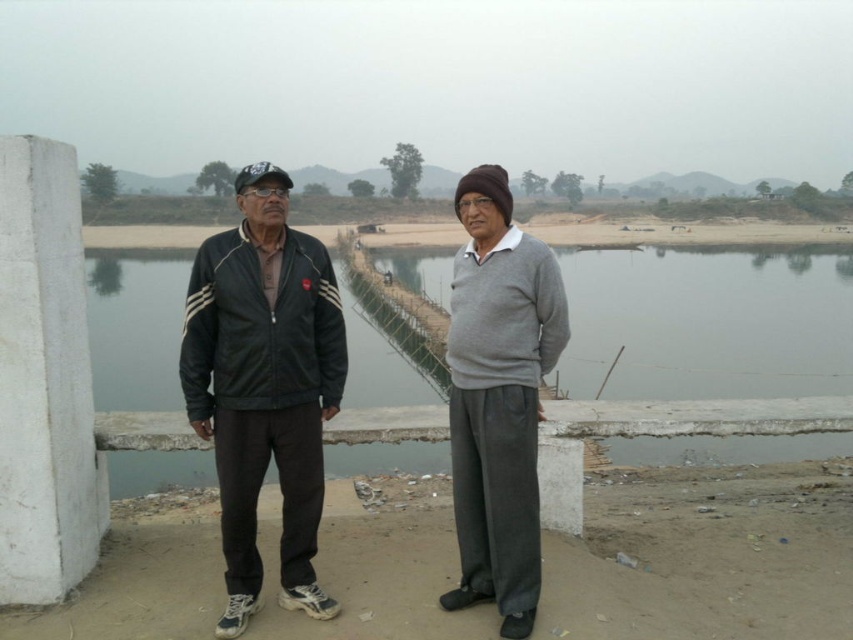
Is black leather jacket at center smaller than gray wool sweater at center?

Correct, black leather jacket at center occupies less space than gray wool sweater at center.

Which of these two, black leather jacket at center or gray wool sweater at center, stands shorter?

With less height is black leather jacket at center.

Between point (201, 403) and point (512, 445), which one is positioned behind?

The point (201, 403) is behind.

I want to click on black leather jacket at center, so click(x=263, y=385).

Which is below, black leather jacket at center or gray concrete river at center?

black leather jacket at center is below.

From the picture: Does black leather jacket at center have a greater height compared to gray concrete river at center?

Incorrect, black leather jacket at center's height is not larger of gray concrete river at center's.

Locate an element on the screen. This screenshot has width=853, height=640. black leather jacket at center is located at coordinates (263, 385).

This screenshot has height=640, width=853. I want to click on black leather jacket at center, so click(x=263, y=385).

Can you confirm if black leather jacket at left is smaller than gray wool sweater at center?

Actually, black leather jacket at left might be larger than gray wool sweater at center.

This screenshot has height=640, width=853. Describe the element at coordinates (264, 385) in the screenshot. I see `black leather jacket at left` at that location.

I want to click on black leather jacket at left, so click(264, 385).